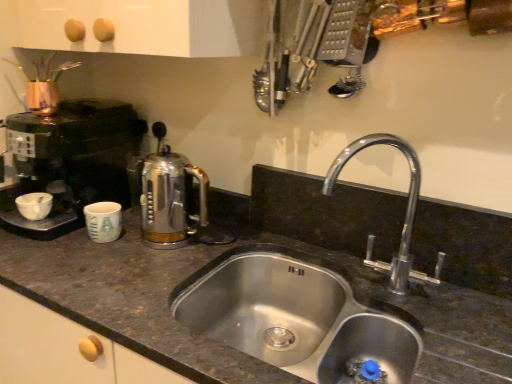
This screenshot has width=512, height=384. I want to click on vacant space underneath chrome metallic faucet at center right (from a real-world perspective), so click(x=376, y=308).